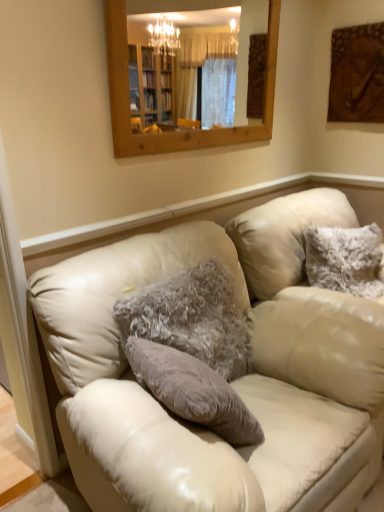
Where is `leather couch at center`? This screenshot has width=384, height=512. leather couch at center is located at coordinates (233, 383).

This screenshot has width=384, height=512. Find the location of `wooden frame mirror at upper center`. wooden frame mirror at upper center is located at coordinates (239, 41).

At what (x,y) coordinates should I click in order to perform the action: click on fuzzy white pillow at upper right, the 1th pillow positioned from the back. Please return your answer as a coordinate pair (x, y). Looking at the image, I should click on (345, 259).

Is there a large distance between leather couch at center and wooden frame mirror at upper center?

Indeed, leather couch at center is not near wooden frame mirror at upper center.

From a real-world perspective, who is located higher, leather couch at center or wooden frame mirror at upper center?

wooden frame mirror at upper center, from a real-world perspective.

Which is in front, point (159, 503) or point (236, 13)?

The point (159, 503) is in front.

Which of these two, leather couch at center or wooden frame mirror at upper center, stands shorter?

wooden frame mirror at upper center is shorter.

Does point (229, 351) come farther from viewer compared to point (369, 295)?

That is False.

Is fuzzy gray pillow at center, the 2th pillow when ordered from back to front, far away from fuzzy white pillow at upper right, positioned as the 1th pillow in right-to-left order?

No, there isn't a large distance between fuzzy gray pillow at center, the 2th pillow when ordered from back to front, and fuzzy white pillow at upper right, positioned as the 1th pillow in right-to-left order.

Is fuzzy gray pillow at center, which is counted as the first pillow, starting from the left, further to camera compared to fuzzy white pillow at upper right, positioned as the 1th pillow in right-to-left order?

No.

Considering the points (321, 352) and (182, 285), which point is behind, point (321, 352) or point (182, 285)?

The point (182, 285) is farther.

Image resolution: width=384 pixels, height=512 pixels. I want to click on studio couch on the right of fuzzy gray pillow at center, which is counted as the first pillow, starting from the left, so click(x=233, y=383).

From the image's perspective, which one is positioned lower, leather couch at center or fuzzy gray pillow at center, which is counted as the 1th pillow, starting from the front?

leather couch at center.

In the scene shown: Are leather couch at center and fuzzy gray pillow at center, which is the 2th pillow from right to left, located far from each other?

leather couch at center is near fuzzy gray pillow at center, which is the 2th pillow from right to left, not far away.

In the image, is wooden textured painting at upper right on the left side or the right side of leather couch at center?

From the image, it's evident that wooden textured painting at upper right is to the right of leather couch at center.

Does wooden textured painting at upper right turn towards leather couch at center?

No, wooden textured painting at upper right is not turned towards leather couch at center.

Is wooden textured painting at upper right far away from leather couch at center?

Yes, wooden textured painting at upper right and leather couch at center are quite far apart.

Considering the positions of objects wooden textured painting at upper right and leather couch at center in the image provided, who is in front, wooden textured painting at upper right or leather couch at center?

leather couch at center is more forward.

From a real-world perspective, which object rests below the other?

In real-world perspective, leather couch at center is lower.

Considering the positions of points (378, 348) and (356, 93), is point (378, 348) closer to camera compared to point (356, 93)?

That is True.

Which of these two, leather couch at center or wooden textured painting at upper right, is wider?

With larger width is leather couch at center.

From the image's perspective, is leather couch at center under wooden textured painting at upper right?

Yes, from the image's perspective, leather couch at center is beneath wooden textured painting at upper right.

Could you tell me if wooden frame mirror at upper center is facing leather couch at center?

No, wooden frame mirror at upper center is not oriented towards leather couch at center.

Is point (242, 99) farther from camera compared to point (279, 203)?

Yes, it is behind point (279, 203).

Considering the relative sizes of wooden frame mirror at upper center and leather couch at center in the image provided, is wooden frame mirror at upper center thinner than leather couch at center?

Yes.

Is wooden frame mirror at upper center touching leather couch at center?

wooden frame mirror at upper center and leather couch at center are not in contact.

Consider the image. Is wooden textured painting at upper right closer to the viewer compared to fuzzy gray pillow at center, which is the 2th pillow from right to left?

That is False.

Based on their sizes in the image, would you say wooden textured painting at upper right is bigger or smaller than fuzzy gray pillow at center, which is counted as the 1th pillow, starting from the front?

In the image, wooden textured painting at upper right appears to be smaller than fuzzy gray pillow at center, which is counted as the 1th pillow, starting from the front.

From the image's perspective, is wooden textured painting at upper right located above or below fuzzy gray pillow at center, which is the 2th pillow from right to left?

Clearly, from the image's perspective, wooden textured painting at upper right is above fuzzy gray pillow at center, which is the 2th pillow from right to left.

Looking at this image, how many degrees apart are the facing directions of wooden textured painting at upper right and fuzzy gray pillow at center, which is counted as the 1th pillow, starting from the front?

The angular difference between wooden textured painting at upper right and fuzzy gray pillow at center, which is counted as the 1th pillow, starting from the front, is 87.4 degrees.

Find the location of a particular element. The height and width of the screenshot is (512, 384). studio couch on the left of wooden frame mirror at upper center is located at coordinates (233, 383).

Image resolution: width=384 pixels, height=512 pixels. I want to click on pillow below the fuzzy white pillow at upper right, acting as the 2th pillow starting from the left (from the image's perspective), so click(x=191, y=318).

When comparing their distances from wooden textured painting at upper right, does fuzzy white pillow at upper right, positioned as the 1th pillow in right-to-left order, or fuzzy gray pillow at center, which is counted as the 1th pillow, starting from the front, seem closer?

fuzzy white pillow at upper right, positioned as the 1th pillow in right-to-left order, is closer to wooden textured painting at upper right.

When comparing their distances from wooden textured painting at upper right, does leather couch at center or fuzzy white pillow at upper right, positioned as the 1th pillow in right-to-left order, seem closer?

fuzzy white pillow at upper right, positioned as the 1th pillow in right-to-left order, lies closer to wooden textured painting at upper right than the other object.

Consider the image. Looking at the image, which one is located closer to wooden frame mirror at upper center, leather couch at center or fuzzy white pillow at upper right, the second pillow viewed from the front?

Among the two, fuzzy white pillow at upper right, the second pillow viewed from the front, is located nearer to wooden frame mirror at upper center.

From the image, which object appears to be farther from fuzzy white pillow at upper right, acting as the 2th pillow starting from the left, wooden frame mirror at upper center or fuzzy gray pillow at center, which is counted as the first pillow, starting from the left?

wooden frame mirror at upper center is further to fuzzy white pillow at upper right, acting as the 2th pillow starting from the left.

In the scene shown: When comparing their distances from fuzzy white pillow at upper right, the second pillow viewed from the front, does leather couch at center or fuzzy gray pillow at center, which is the 2th pillow from right to left, seem closer?

leather couch at center is closer to fuzzy white pillow at upper right, the second pillow viewed from the front.

From the image, which object appears to be nearer to wooden frame mirror at upper center, fuzzy white pillow at upper right, the second pillow viewed from the front, or leather couch at center?

fuzzy white pillow at upper right, the second pillow viewed from the front, is positioned closer to the anchor wooden frame mirror at upper center.

Considering their positions, is wooden frame mirror at upper center positioned closer to wooden textured painting at upper right than fuzzy white pillow at upper right, positioned as the 1th pillow in right-to-left order?

fuzzy white pillow at upper right, positioned as the 1th pillow in right-to-left order, is positioned closer to the anchor wooden textured painting at upper right.

Considering their positions, is fuzzy gray pillow at center, which is counted as the 1th pillow, starting from the front, positioned further to wooden frame mirror at upper center than fuzzy white pillow at upper right, positioned as the 1th pillow in right-to-left order?

fuzzy gray pillow at center, which is counted as the 1th pillow, starting from the front, is positioned further to the anchor wooden frame mirror at upper center.

Locate an element on the screen. pillow between wooden frame mirror at upper center and fuzzy gray pillow at center, which is counted as the 1th pillow, starting from the front, in the vertical direction is located at coordinates (345, 259).

Identify the location of pillow between wooden textured painting at upper right and fuzzy gray pillow at center, the 2th pillow when ordered from back to front, vertically. This screenshot has height=512, width=384. (345, 259).

This screenshot has width=384, height=512. I want to click on mirror between wooden textured painting at upper right and leather couch at center vertically, so click(x=239, y=41).

Find the location of `pillow between leather couch at center and fuzzy white pillow at upper right, the 1th pillow positioned from the back, along the z-axis`. pillow between leather couch at center and fuzzy white pillow at upper right, the 1th pillow positioned from the back, along the z-axis is located at coordinates (191, 318).